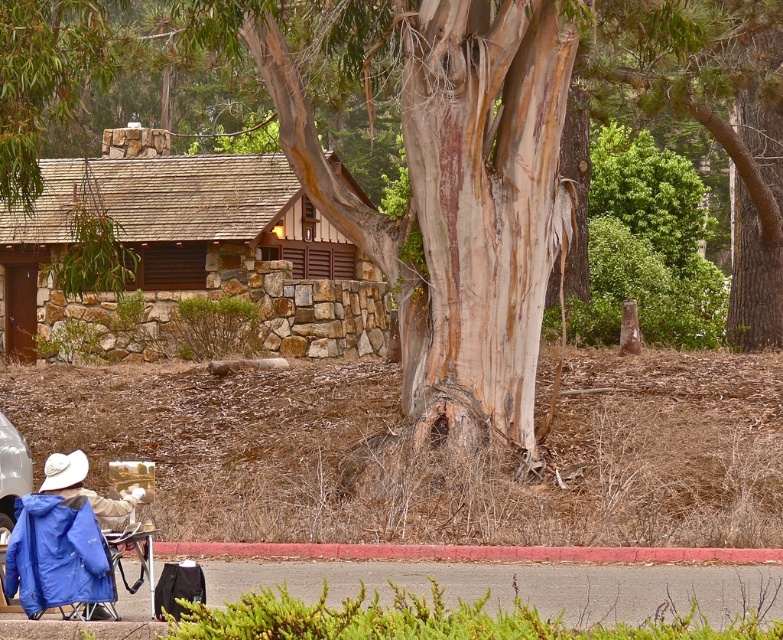
Question: Does stone cabin at center appear on the left side of blue fabric jacket at lower left?

Choices:
 (A) no
 (B) yes

Answer: (A)

Question: Which point is closer to the camera?

Choices:
 (A) white matte cowboy hat at lower left
 (B) blue fabric jacket at lower left
 (C) stone cabin at center

Answer: (B)

Question: Which point appears farthest from the camera in this image?

Choices:
 (A) (291, 179)
 (B) (74, 483)

Answer: (A)

Question: Which of the following is the closest to the observer?

Choices:
 (A) (135, 196)
 (B) (110, 513)
 (C) (71, 461)

Answer: (B)

Question: In this image, where is stone cabin at center located relative to white matte cowboy hat at lower left?

Choices:
 (A) below
 (B) above

Answer: (B)

Question: Observing the image, what is the correct spatial positioning of blue fabric jacket at lower left in reference to white matte cowboy hat at lower left?

Choices:
 (A) left
 (B) right

Answer: (B)